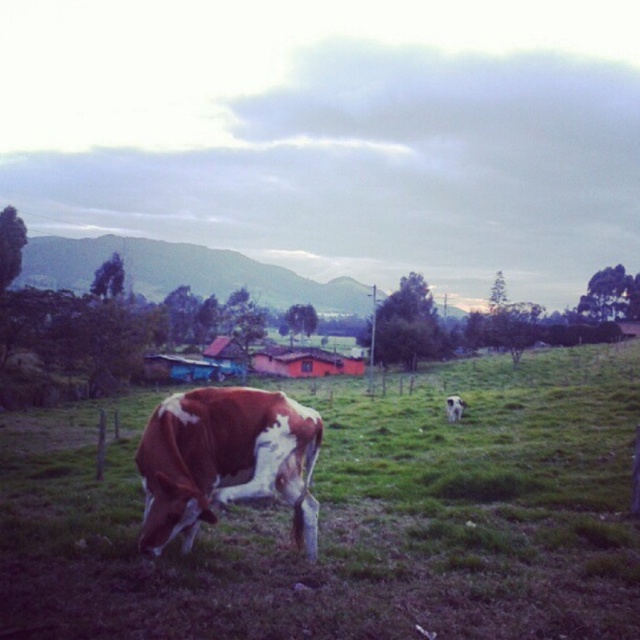
Between brown speckled cow at lower left and white fur at center, which one has less height?

white fur at center

Between brown speckled cow at lower left and white fur at center, which one appears on the right side from the viewer's perspective?

white fur at center

You are a GUI agent. You are given a task and a screenshot of the screen. Output one action in this format:
    pyautogui.click(x=<x>, y=<y>)
    Task: Click on the brown speckled cow at lower left
    
    Given the screenshot: What is the action you would take?
    pyautogui.click(x=353, y=516)

Does point (177, 557) lie behind point (196, 433)?

Yes, point (177, 557) is farther from viewer.

Does brown speckled cow at lower left come behind brown speckled cow at center?

No, brown speckled cow at lower left is in front of brown speckled cow at center.

Does point (257, 634) come behind point (220, 403)?

No, (257, 634) is closer to viewer.

Where is `brown speckled cow at lower left`? This screenshot has width=640, height=640. brown speckled cow at lower left is located at coordinates (353, 516).

Can you confirm if brown speckled cow at center is shorter than white fur at center?

No, brown speckled cow at center is not shorter than white fur at center.

Is the position of brown speckled cow at center less distant than that of white fur at center?

Yes, brown speckled cow at center is in front of white fur at center.

Is point (260, 483) positioned in front of point (460, 406)?

Yes.

The image size is (640, 640). I want to click on brown speckled cow at center, so click(x=225, y=460).